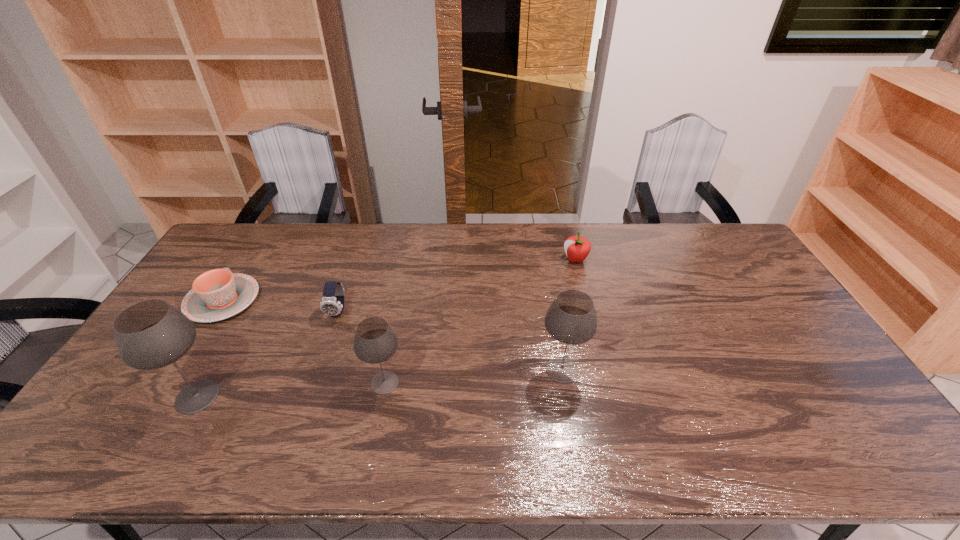
In the current image, all wineglasss are evenly spaced. To maintain this equal spacing, where should an additional wineglass be placed on the right? Please point out a free spot. Please provide its 2D coordinates. Your answer should be formatted as a tuple, i.e. [(x, y)], where the tuple contains the x and y coordinates of a point satisfying the conditions above.

[(730, 357)]